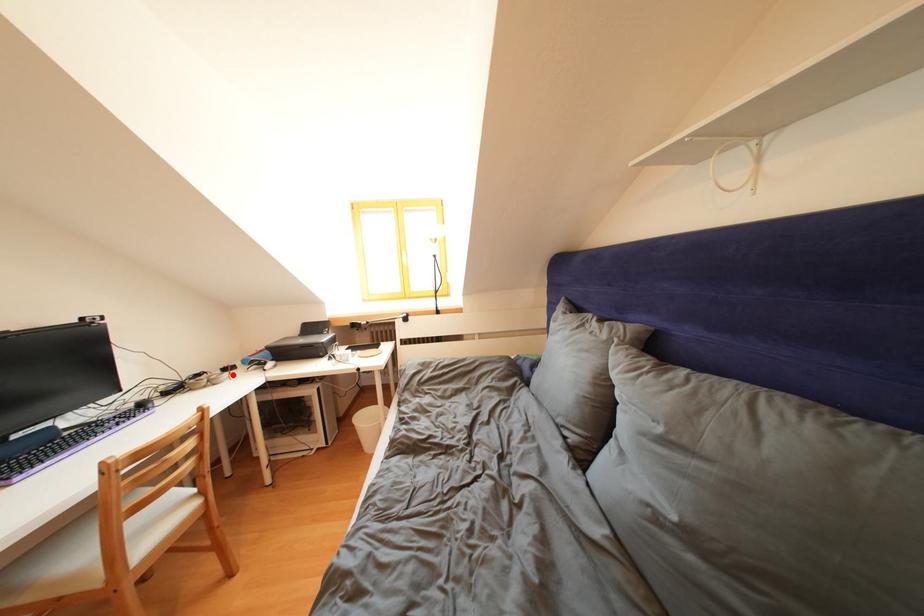
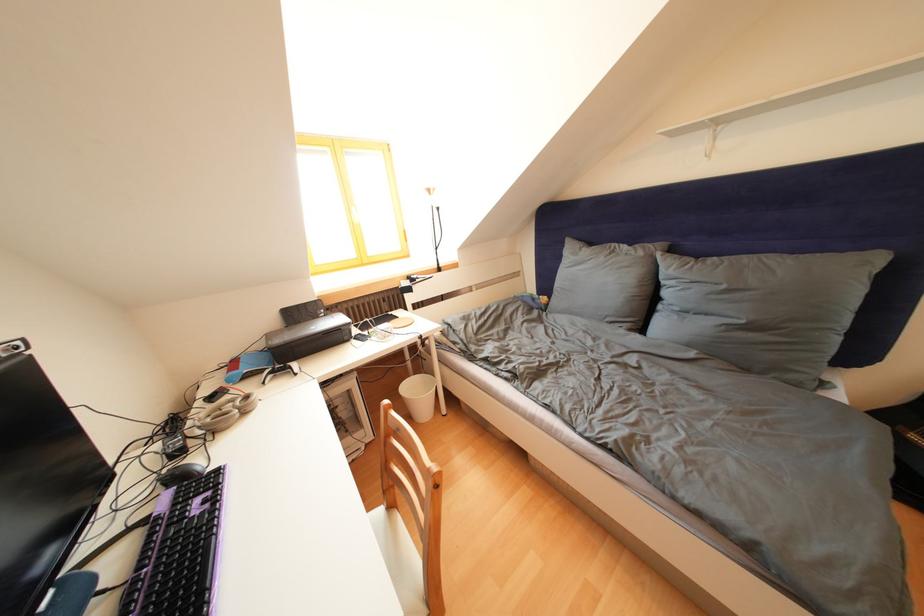
Where in the second image is the point corresponding to the highlighted location from the first image?

(220, 403)